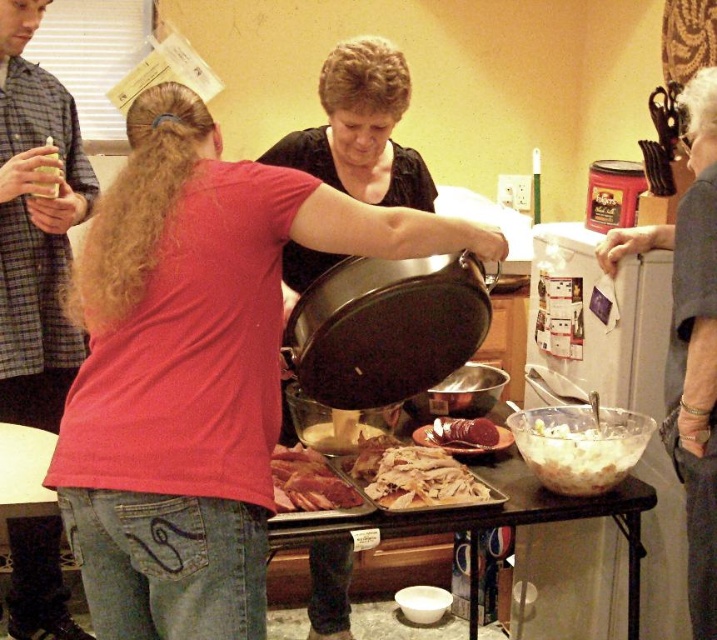
Between matte black pan at center and sliced pink meat at center, which one is positioned lower?

sliced pink meat at center

Is matte black pan at center to the right of sliced pink meat at center from the viewer's perspective?

In fact, matte black pan at center is to the left of sliced pink meat at center.

Image resolution: width=717 pixels, height=640 pixels. What are the coordinates of `matte black pan at center` in the screenshot? It's located at (194, 369).

Does brushed metal can at upper left come in front of translucent plastic cup at upper left?

Yes, brushed metal can at upper left is closer to the viewer.

The image size is (717, 640). In order to click on brushed metal can at upper left in this screenshot , I will do `click(34, 227)`.

The height and width of the screenshot is (640, 717). I want to click on brushed metal can at upper left, so click(x=34, y=227).

Who is shorter, matte black pan at center or translucent plastic cup at upper left?

Answer: translucent plastic cup at upper left is shorter.

Can you confirm if matte black pan at center is smaller than translucent plastic cup at upper left?

Incorrect, matte black pan at center is not smaller in size than translucent plastic cup at upper left.

Who is more forward, (166, 451) or (39, 170)?

Point (166, 451) is more forward.

At what (x,y) coordinates should I click in order to perform the action: click on matte black pan at center. Please return your answer as a coordinate pair (x, y). Looking at the image, I should click on [x=194, y=369].